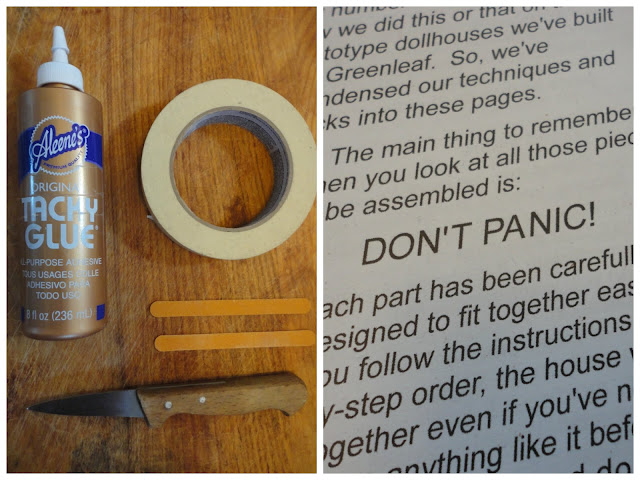
You are a GUI agent. You are given a task and a screenshot of the screen. Output one action in this format:
    pyautogui.click(x=<x>, y=<y>)
    Task: Click on the masking tape
    This screenshot has width=640, height=480.
    Given the screenshot: What is the action you would take?
    pyautogui.click(x=241, y=249)